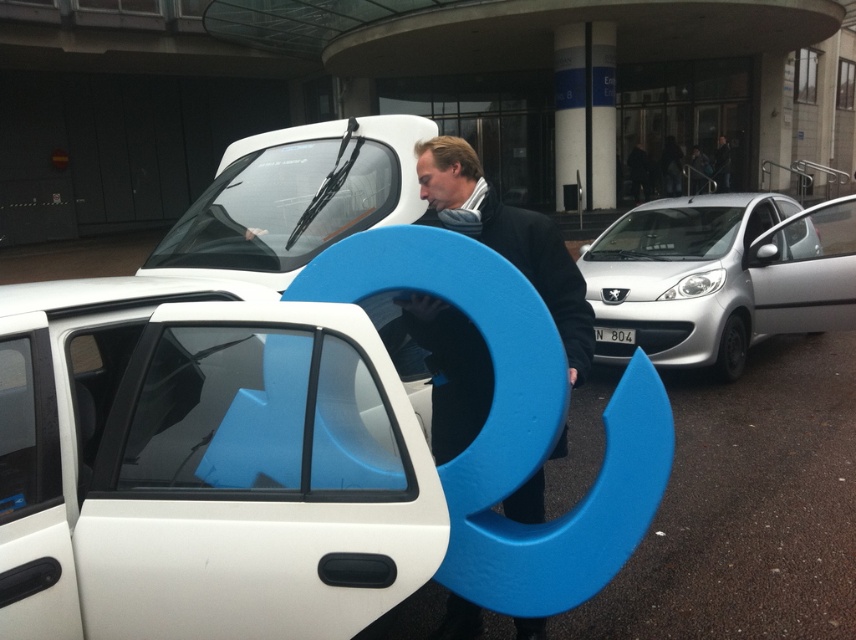
Can you confirm if white matte car at center is bigger than white plastic license plate at center?

Yes, white matte car at center is bigger than white plastic license plate at center.

At what (x,y) coordinates should I click in order to perform the action: click on white matte car at center. Please return your answer as a coordinate pair (x, y). Looking at the image, I should click on (295, 198).

Measure the distance between white matte car door at center and silver metallic car at right.

They are 5.52 meters apart.

Can you confirm if white matte car door at center is positioned above silver metallic car at right?

No.

Who is more distant from viewer, [321,564] or [675,280]?

The point [675,280] is behind.

Locate an element on the screen. The image size is (856, 640). white matte car door at center is located at coordinates (201, 465).

Is silver metallic car at right positioned behind matte blue sculpture at center?

That is True.

Does silver metallic car at right have a lesser height compared to matte blue sculpture at center?

In fact, silver metallic car at right may be taller than matte blue sculpture at center.

Who is more forward, [776,332] or [542,252]?

Point [542,252] is more forward.

You are a GUI agent. You are given a task and a screenshot of the screen. Output one action in this format:
    pyautogui.click(x=<x>, y=<y>)
    Task: Click on the silver metallic car at right
    The image size is (856, 640).
    Given the screenshot: What is the action you would take?
    pyautogui.click(x=721, y=276)